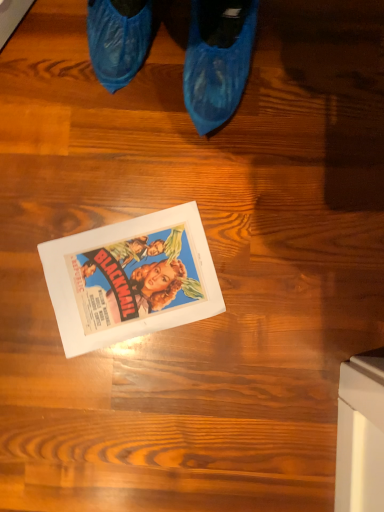
This screenshot has height=512, width=384. In order to click on empty space that is ontop of matte white framed poster at center (from a real-world perspective) in this screenshot , I will do `click(130, 276)`.